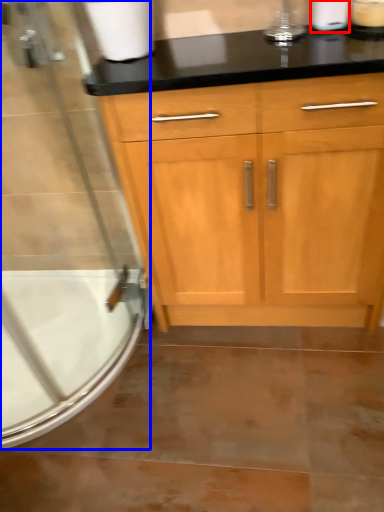
Question: Which of the following is the farthest to the observer, toilet paper (highlighted by a red box) or screen door (highlighted by a blue box)?

Choices:
 (A) toilet paper
 (B) screen door

Answer: (A)